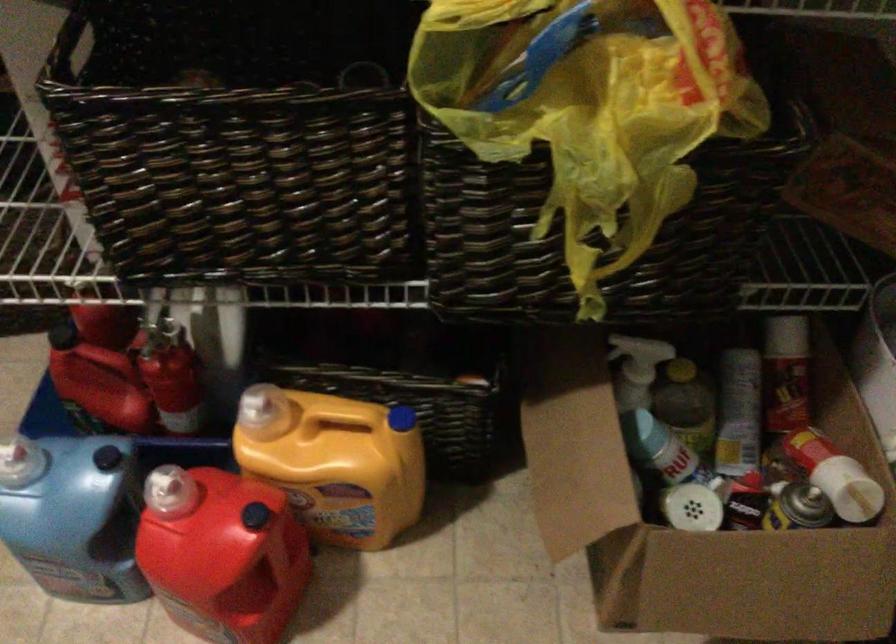
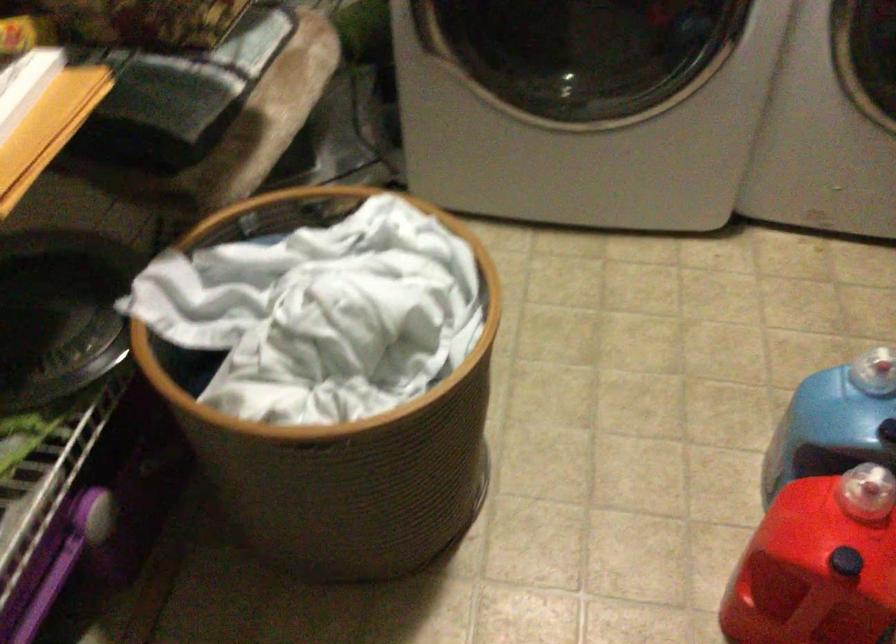
In the second image, find the point that corresponds to (x=242, y=538) in the first image.

(814, 571)